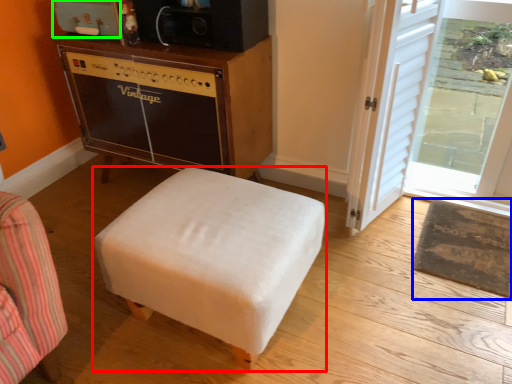
Question: Based on their relative distances, which object is nearer to furniture (highlighted by a red box)? Choose from mat (highlighted by a blue box) and appliance (highlighted by a green box).

Choices:
 (A) mat
 (B) appliance

Answer: (A)